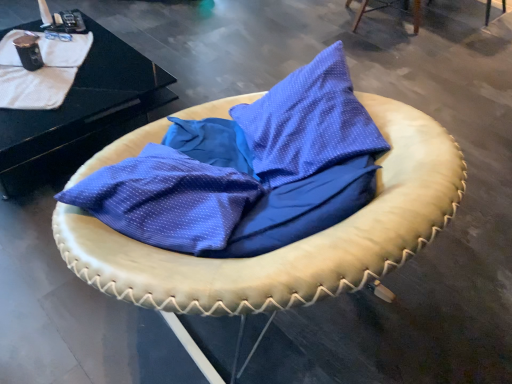
Question: Looking at their shapes, would you say leather cushion at upper right, the 2th furniture viewed from the front, is wider or thinner than white textured blanket at upper left?

Choices:
 (A) thin
 (B) wide

Answer: (B)

Question: From a real-world perspective, is leather cushion at upper right, the second furniture positioned from the left, above or below white textured blanket at upper left?

Choices:
 (A) below
 (B) above

Answer: (A)

Question: Estimate the real-world distances between objects in this image. Which object is farther from the white textured blanket at upper left?

Choices:
 (A) leather cushion at upper right, positioned as the first furniture in top-to-bottom order
 (B) black glossy table at upper left
 (C) leather cushion at center, the 1th furniture from the left

Answer: (A)

Question: Which is farther from the leather cushion at upper right, the second furniture positioned from the left?

Choices:
 (A) white textured blanket at upper left
 (B) black glossy table at upper left
 (C) leather cushion at center, the second furniture when ordered from right to left

Answer: (C)